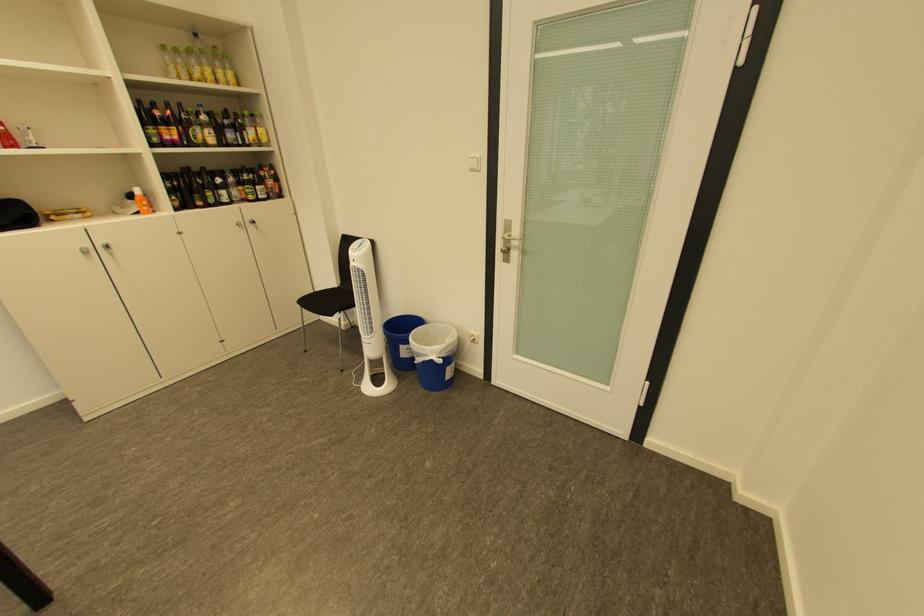
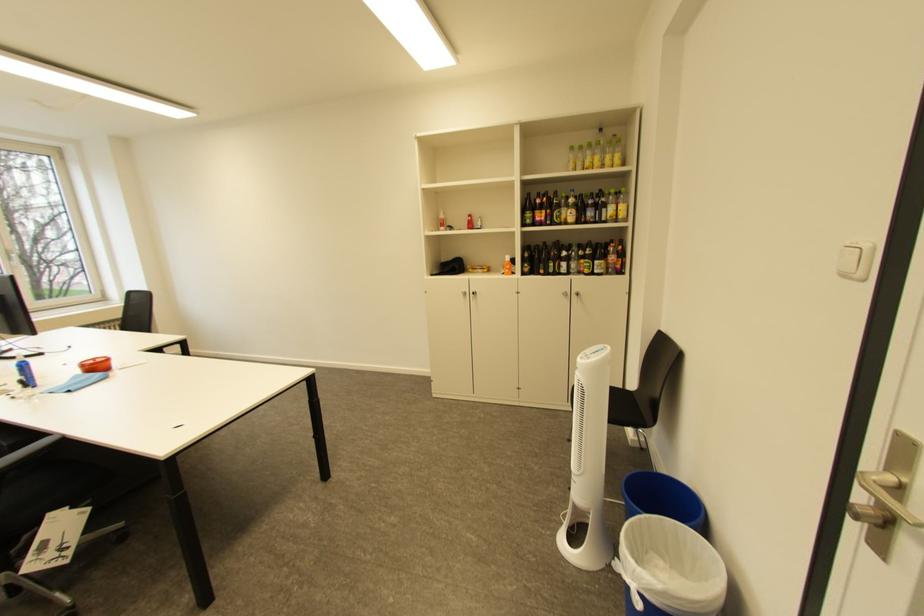
Find the pixel in the second image that matches (x=435, y=357) in the first image.

(636, 570)